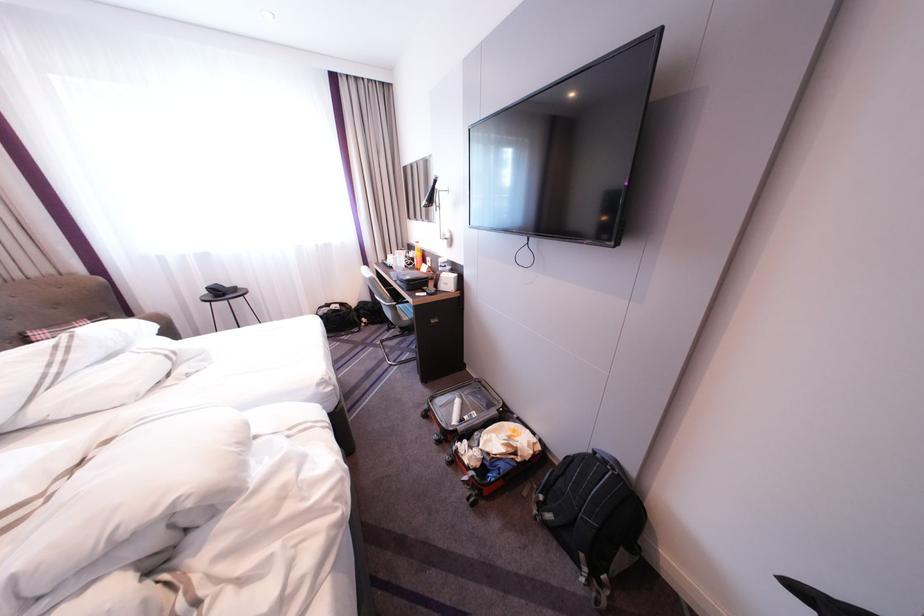
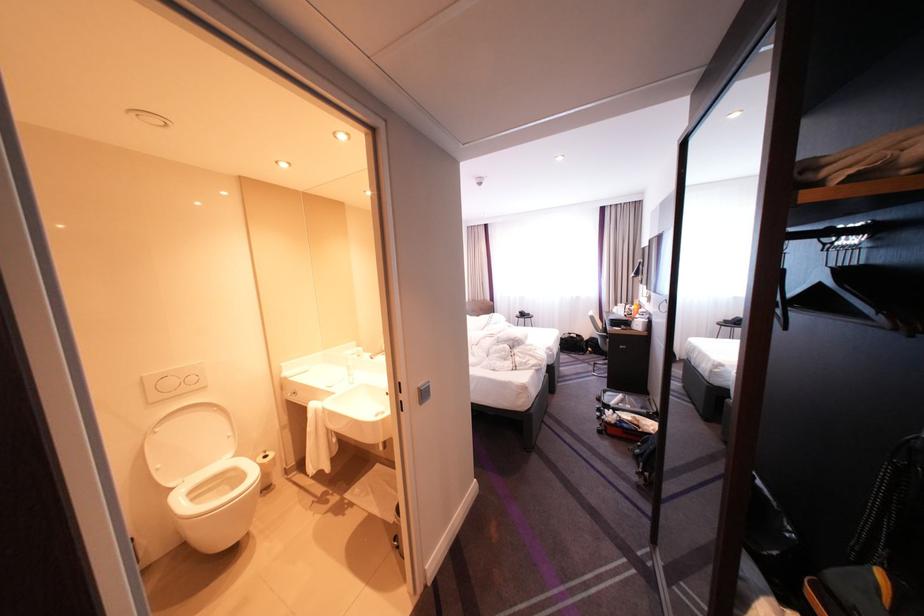
Find the pixel in the second image that matches (365,305) in the first image.

(599, 338)